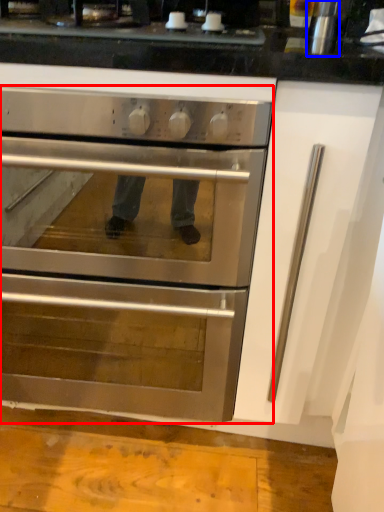
Question: Which object is closer to the camera taking this photo, oven (highlighted by a red box) or appliance (highlighted by a blue box)?

Choices:
 (A) oven
 (B) appliance

Answer: (A)